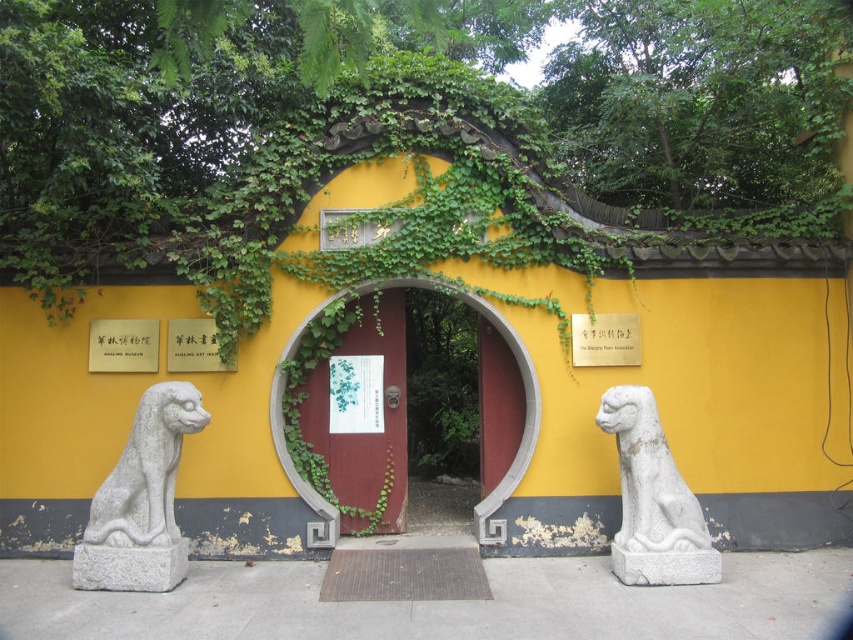
This screenshot has width=853, height=640. Describe the element at coordinates (123, 346) in the screenshot. I see `matte gold plaque at center left` at that location.

Does point (97, 344) lie in front of point (169, 348)?

Yes, point (97, 344) is closer to viewer.

You are a GUI agent. You are given a task and a screenshot of the screen. Output one action in this format:
    pyautogui.click(x=<x>, y=<y>)
    Task: Click on the matte gold plaque at center left
    The height and width of the screenshot is (640, 853).
    Given the screenshot: What is the action you would take?
    pyautogui.click(x=123, y=346)

Does green ivy at center appear under matte gold plaque at center?

No, green ivy at center is not below matte gold plaque at center.

Does green ivy at center have a lesser width compared to matte gold plaque at center?

No, green ivy at center is not thinner than matte gold plaque at center.

Identify the location of green ivy at center. (410, 136).

Does green ivy at center lie in front of white paper at center?

That is False.

Is green ivy at center shorter than white paper at center?

Yes, green ivy at center is shorter than white paper at center.

What are the coordinates of `green ivy at center` in the screenshot? It's located at (410, 136).